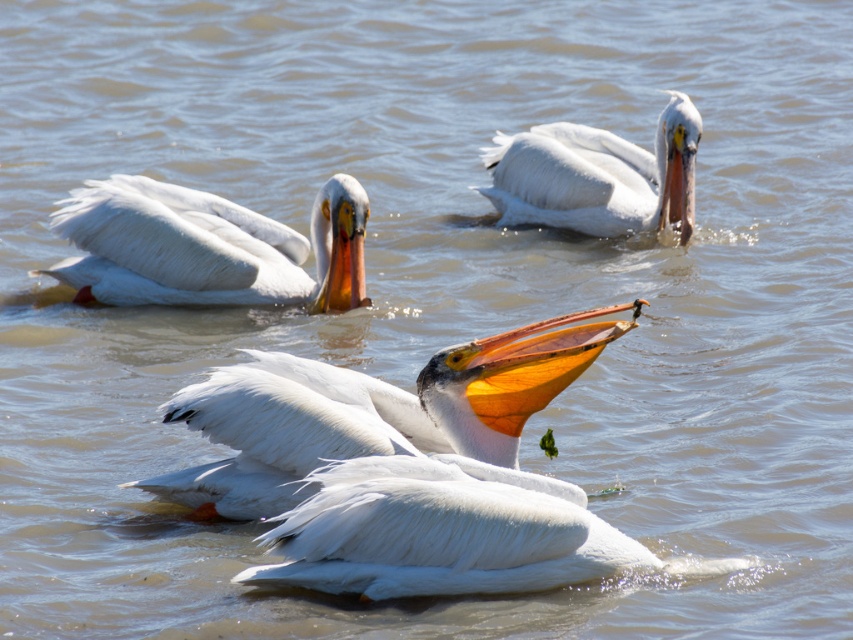
Is white matte pelican at center bigger than white matte pelican at upper right?

Yes, white matte pelican at center is bigger than white matte pelican at upper right.

Is white matte pelican at center below white matte pelican at upper right?

Indeed, white matte pelican at center is positioned under white matte pelican at upper right.

In order to click on white matte pelican at center in this screenshot , I will do `click(368, 412)`.

Can you confirm if white feathered pelican at center is wider than white matte pelican at upper left?

No, white feathered pelican at center is not wider than white matte pelican at upper left.

Can you confirm if white feathered pelican at center is shorter than white matte pelican at upper left?

Yes.

The height and width of the screenshot is (640, 853). What are the coordinates of `white feathered pelican at center` in the screenshot? It's located at (439, 531).

Locate an element on the screen. This screenshot has width=853, height=640. white feathered pelican at center is located at coordinates (439, 531).

Does white feathered pelican at center have a lesser height compared to white matte pelican at upper right?

Yes, white feathered pelican at center is shorter than white matte pelican at upper right.

Is white feathered pelican at center taller than white matte pelican at upper right?

No, white feathered pelican at center is not taller than white matte pelican at upper right.

Is point (358, 500) farther from camera compared to point (662, 225)?

No.

Image resolution: width=853 pixels, height=640 pixels. In order to click on white feathered pelican at center in this screenshot , I will do `click(439, 531)`.